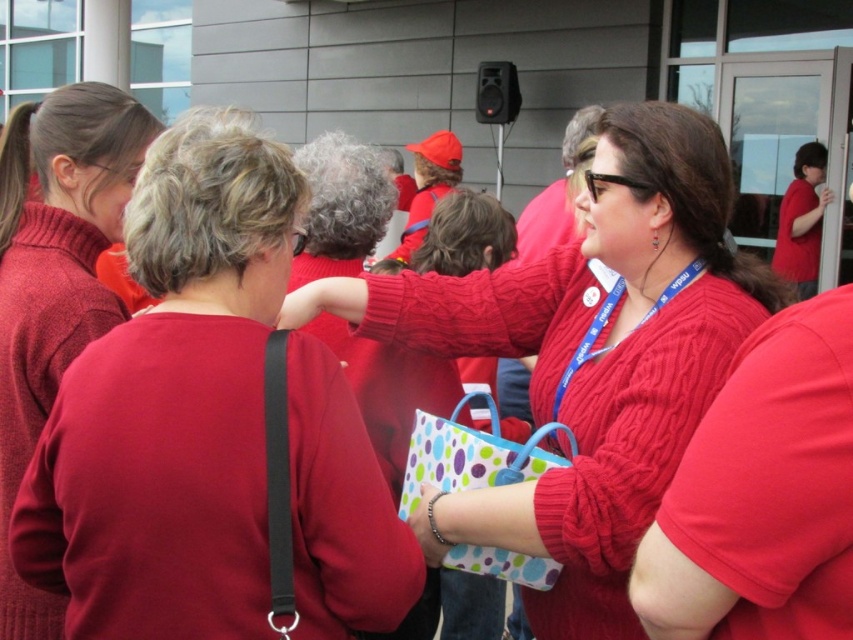
Question: Which object is positioned closest to the cable-knit sweater at left?

Choices:
 (A) polka dot fabric bag at center
 (B) blue fabric lanyard at center
 (C) cable-knit sweater at center
 (D) matte red sweater at upper left

Answer: (A)

Question: Does cable-knit sweater at left appear under polka dot fabric bag at center?

Choices:
 (A) no
 (B) yes

Answer: (A)

Question: Does cable-knit sweater at center appear on the left side of polka dot fabric bag at center?

Choices:
 (A) no
 (B) yes

Answer: (A)

Question: Which object appears closest to the camera in this image?

Choices:
 (A) polka dot fabric bag at center
 (B) cable-knit sweater at center

Answer: (B)

Question: Does cable-knit sweater at left have a lesser width compared to matte red sweater at upper left?

Choices:
 (A) no
 (B) yes

Answer: (A)

Question: Which of the following is the closest to the observer?

Choices:
 (A) blue fabric lanyard at center
 (B) cable-knit sweater at center
 (C) cable-knit sweater at left
 (D) matte red sweater at upper left

Answer: (C)